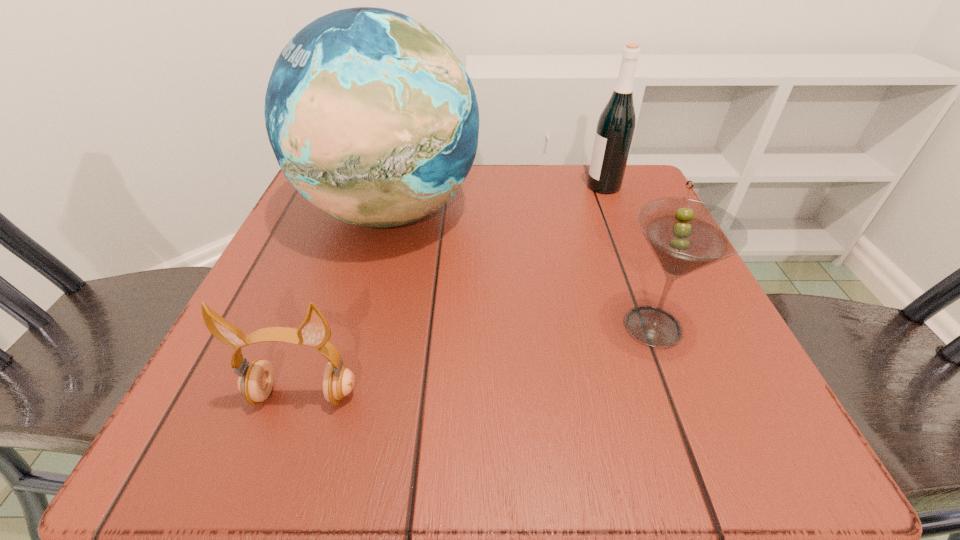
Locate an element on the screen. This screenshot has height=540, width=960. free space between the second shortest object and the wine bottle is located at coordinates (628, 256).

The height and width of the screenshot is (540, 960). What are the coordinates of `blank region between the martini and the nearest object` in the screenshot? It's located at (478, 360).

You are a GUI agent. You are given a task and a screenshot of the screen. Output one action in this format:
    pyautogui.click(x=<x>, y=<y>)
    Task: Click on the empty space that is in between the third shortest object and the globe
    
    Given the screenshot: What is the action you would take?
    coord(497,199)

This screenshot has height=540, width=960. In order to click on blank region between the wine bottle and the nearest object in this screenshot , I will do `click(453, 291)`.

Find the location of a particular element. The image size is (960, 540). free space that is in between the shortest object and the globe is located at coordinates (347, 303).

Identify the location of vacant region between the tallest object and the wine bottle. The width and height of the screenshot is (960, 540). (497, 199).

Locate an element on the screen. free space between the globe and the wine bottle is located at coordinates (497, 199).

Image resolution: width=960 pixels, height=540 pixels. In order to click on vacant area that lies between the third farthest object and the wine bottle in this screenshot , I will do `click(628, 256)`.

Identify which object is located as the second nearest to the martini. Please provide its 2D coordinates. Your answer should be formatted as a tuple, i.e. [(x, y)], where the tuple contains the x and y coordinates of a point satisfying the conditions above.

[(616, 125)]

What are the coordinates of `object that is the third closest to the globe` in the screenshot? It's located at (616, 125).